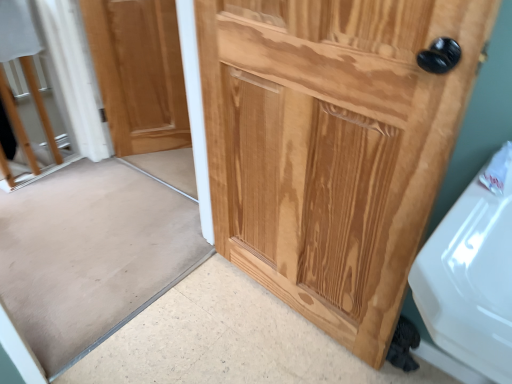
Question: Considering the relative positions of natural wood door at upper left, arranged as the first door when viewed from the back, and natural wood door at right, the 1th door from the front, in the image provided, is natural wood door at upper left, arranged as the first door when viewed from the back, in front of natural wood door at right, the 1th door from the front,?

Choices:
 (A) no
 (B) yes

Answer: (A)

Question: Is natural wood door at upper left, the second door viewed from the right, placed right next to natural wood door at right, acting as the first door starting from the right?

Choices:
 (A) no
 (B) yes

Answer: (A)

Question: Considering the relative sizes of natural wood door at upper left, which is counted as the 1th door, starting from the left, and natural wood door at right, acting as the first door starting from the right, in the image provided, is natural wood door at upper left, which is counted as the 1th door, starting from the left, smaller than natural wood door at right, acting as the first door starting from the right,?

Choices:
 (A) no
 (B) yes

Answer: (B)

Question: Is natural wood door at upper left, the second door viewed from the right, bigger than natural wood door at right, which is the second door from back to front?

Choices:
 (A) no
 (B) yes

Answer: (A)

Question: Can you confirm if natural wood door at upper left, which is counted as the second door, starting from the front, is thinner than natural wood door at right, acting as the first door starting from the right?

Choices:
 (A) no
 (B) yes

Answer: (B)

Question: Does natural wood door at upper left, which is counted as the second door, starting from the front, appear on the right side of natural wood door at right, positioned as the 2th door in left-to-right order?

Choices:
 (A) yes
 (B) no

Answer: (B)

Question: Is natural wood screen door at center far from natural wood door at right, which is the second door from back to front?

Choices:
 (A) no
 (B) yes

Answer: (A)

Question: Does natural wood screen door at center lie in front of natural wood door at right, positioned as the 2th door in left-to-right order?

Choices:
 (A) yes
 (B) no

Answer: (B)

Question: From a real-world perspective, is natural wood screen door at center positioned under natural wood door at right, the 1th door from the front, based on gravity?

Choices:
 (A) no
 (B) yes

Answer: (B)

Question: Considering the relative sizes of natural wood screen door at center and natural wood door at right, positioned as the 2th door in left-to-right order, in the image provided, is natural wood screen door at center taller than natural wood door at right, positioned as the 2th door in left-to-right order,?

Choices:
 (A) no
 (B) yes

Answer: (A)

Question: Is natural wood screen door at center bigger than natural wood door at right, positioned as the 2th door in left-to-right order?

Choices:
 (A) yes
 (B) no

Answer: (B)

Question: Is natural wood screen door at center located outside natural wood door at right, the 1th door from the front?

Choices:
 (A) no
 (B) yes

Answer: (B)

Question: Is natural wood screen door at center positioned behind natural wood door at upper left, which is counted as the 1th door, starting from the left?

Choices:
 (A) no
 (B) yes

Answer: (A)